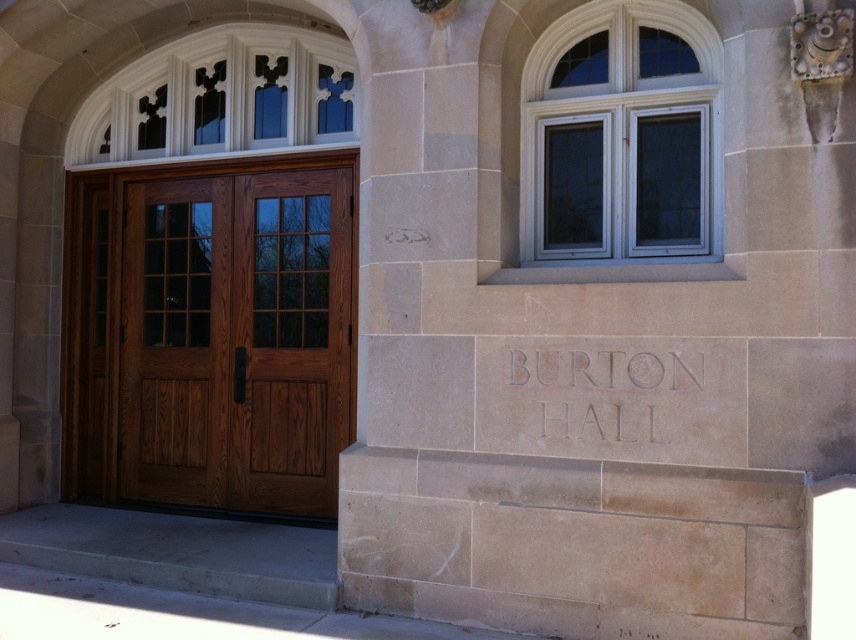
Question: Is mahogany wood door at center above carved stone sign at center?

Choices:
 (A) no
 (B) yes

Answer: (B)

Question: Is beige stone pillar at center in front of mahogany wood door at center?

Choices:
 (A) no
 (B) yes

Answer: (B)

Question: Does beige stone pillar at center have a lesser width compared to carved stone sign at center?

Choices:
 (A) yes
 (B) no

Answer: (B)

Question: Which object is closer to the camera taking this photo?

Choices:
 (A) mahogany wood door at center
 (B) beige stone pillar at center
 (C) carved stone sign at center

Answer: (B)

Question: Which object is the closest to the beige stone pillar at center?

Choices:
 (A) mahogany wood door at center
 (B) carved stone sign at center

Answer: (B)

Question: Which object appears closest to the camera in this image?

Choices:
 (A) carved stone sign at center
 (B) beige stone pillar at center
 (C) mahogany wood door at center

Answer: (B)